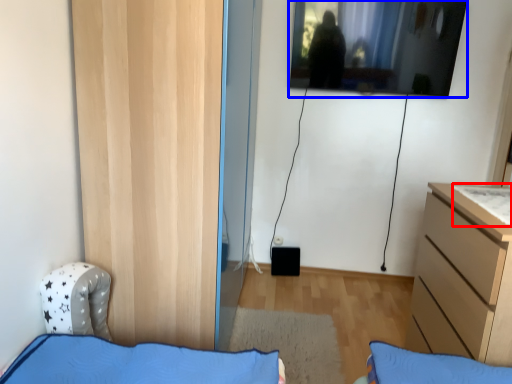
Question: Which object is further to the camera taking this photo, sheet (highlighted by a red box) or window (highlighted by a blue box)?

Choices:
 (A) sheet
 (B) window

Answer: (B)